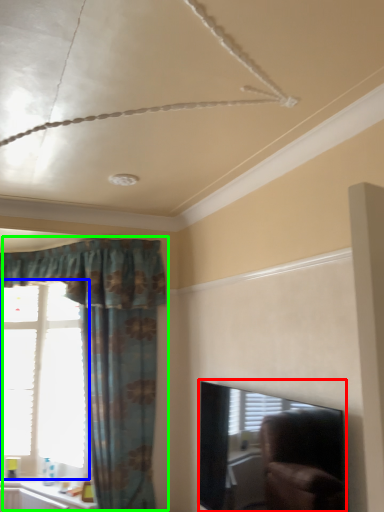
Question: Based on their relative distances, which object is farther from window screen (highlighted by a red box)? Choose from window (highlighted by a blue box) and curtain (highlighted by a green box).

Choices:
 (A) window
 (B) curtain

Answer: (A)